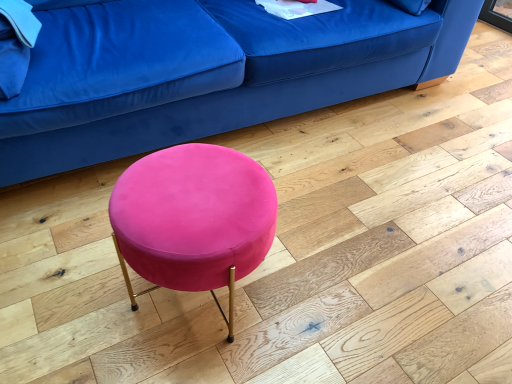
Describe the element at coordinates (208, 72) in the screenshot. The width and height of the screenshot is (512, 384). I see `velvet blue couch at upper center` at that location.

The height and width of the screenshot is (384, 512). In order to click on velvet blue couch at upper center in this screenshot , I will do `click(208, 72)`.

The width and height of the screenshot is (512, 384). Describe the element at coordinates (193, 219) in the screenshot. I see `velvet pink stool at center` at that location.

What are the coordinates of `velvet pink stool at center` in the screenshot? It's located at (193, 219).

What is the approximate height of velvet pink stool at center?

It is 39.92 centimeters.

The width and height of the screenshot is (512, 384). I want to click on velvet blue couch at upper center, so click(x=208, y=72).

Would you say velvet blue couch at upper center is to the left or to the right of velvet pink stool at center in the picture?

Based on their positions, velvet blue couch at upper center is located to the right of velvet pink stool at center.

Does velvet blue couch at upper center come in front of velvet pink stool at center?

No, it is behind velvet pink stool at center.

Is point (147, 92) positioned behind point (267, 191)?

That is True.

Based on the photo, from the image's perspective, who appears lower, velvet blue couch at upper center or velvet pink stool at center?

velvet pink stool at center appears lower in the image.

From a real-world perspective, does velvet blue couch at upper center sit lower than velvet pink stool at center?

No, from a real-world perspective, velvet blue couch at upper center is not beneath velvet pink stool at center.

Does velvet blue couch at upper center have a greater width compared to velvet pink stool at center?

Yes, velvet blue couch at upper center is wider than velvet pink stool at center.

Between velvet blue couch at upper center and velvet pink stool at center, which one has less height?

velvet pink stool at center is shorter.

Based on their sizes in the image, would you say velvet blue couch at upper center is bigger or smaller than velvet pink stool at center?

velvet blue couch at upper center is bigger than velvet pink stool at center.

Is velvet blue couch at upper center situated inside velvet pink stool at center or outside?

velvet blue couch at upper center is located beyond the bounds of velvet pink stool at center.

Does velvet blue couch at upper center touch velvet pink stool at center?

No.

Is velvet pink stool at center at the back of velvet blue couch at upper center?

No, velvet pink stool at center is not at the back of velvet blue couch at upper center.

How far apart are velvet blue couch at upper center and velvet pink stool at center?

66.40 centimeters.

What are the coordinates of `studio couch above the velvet pink stool at center (from a real-world perspective)` in the screenshot? It's located at (208, 72).

Visually, is velvet pink stool at center positioned to the left or to the right of velvet blue couch at upper center?

velvet pink stool at center is positioned on velvet blue couch at upper center's left side.

Does velvet pink stool at center lie in front of velvet blue couch at upper center?

Yes, it is in front of velvet blue couch at upper center.

Considering the points (223, 284) and (162, 95), which point is in front, point (223, 284) or point (162, 95)?

Positioned in front is point (223, 284).

In the scene shown: From the image's perspective, is velvet pink stool at center above velvet blue couch at upper center?

Actually, velvet pink stool at center appears below velvet blue couch at upper center in the image.

From a real-world perspective, between velvet pink stool at center and velvet blue couch at upper center, who is vertically lower?

velvet pink stool at center.

Considering the relative sizes of velvet pink stool at center and velvet blue couch at upper center in the image provided, is velvet pink stool at center wider than velvet blue couch at upper center?

In fact, velvet pink stool at center might be narrower than velvet blue couch at upper center.

Based on the photo, does velvet pink stool at center have a lesser height compared to velvet blue couch at upper center?

Correct, velvet pink stool at center is not as tall as velvet blue couch at upper center.

Which of these two, velvet pink stool at center or velvet blue couch at upper center, is bigger?

velvet blue couch at upper center.

From the picture: Would you say velvet pink stool at center is outside velvet blue couch at upper center?

Yes, velvet pink stool at center is located beyond the bounds of velvet blue couch at upper center.

Are velvet pink stool at center and velvet blue couch at upper center making contact?

No, velvet pink stool at center is not in contact with velvet blue couch at upper center.

Does velvet pink stool at center turn towards velvet blue couch at upper center?

No, velvet pink stool at center is not oriented towards velvet blue couch at upper center.

How different are the orientations of velvet pink stool at center and velvet blue couch at upper center in degrees?

They differ by 5.57 degrees in their facing directions.

In order to click on studio couch on the right of velvet pink stool at center in this screenshot , I will do `click(208, 72)`.

Locate an element on the screen. bar stool that is below the velvet blue couch at upper center (from the image's perspective) is located at coordinates (193, 219).

Where is `studio couch on the right of velvet pink stool at center`? The image size is (512, 384). studio couch on the right of velvet pink stool at center is located at coordinates (208, 72).